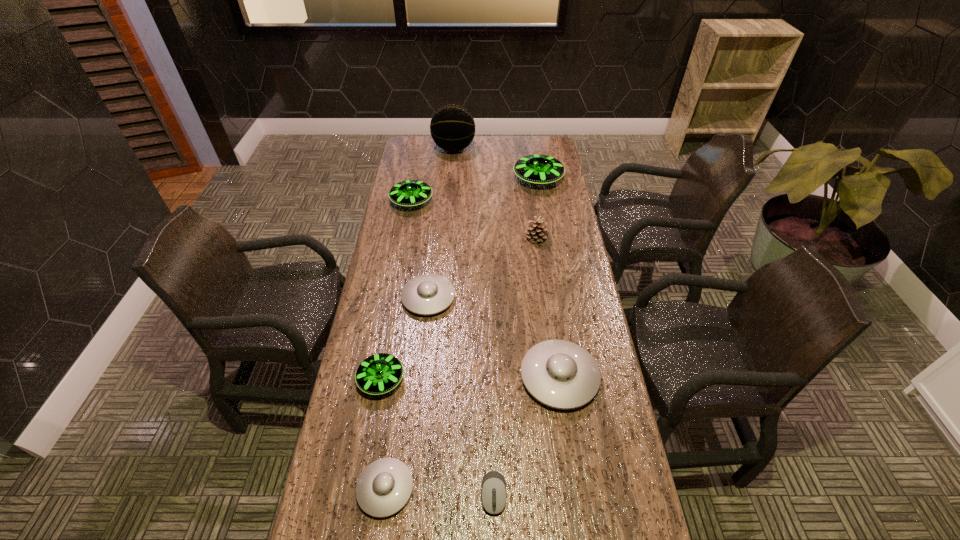
This screenshot has width=960, height=540. What are the coordinates of `basketball` in the screenshot? It's located at (452, 127).

Find the location of `the farthest object`. the farthest object is located at coordinates (452, 127).

The width and height of the screenshot is (960, 540). I want to click on the rightmost green saucer, so click(537, 169).

Locate an element on the screen. The height and width of the screenshot is (540, 960). the biggest green saucer is located at coordinates (537, 169).

Image resolution: width=960 pixels, height=540 pixels. What are the coordinates of `the fourth farthest object` in the screenshot? It's located at (538, 231).

Identify the location of pinecone. (538, 231).

The height and width of the screenshot is (540, 960). Find the location of `the second smallest green saucer`. the second smallest green saucer is located at coordinates (409, 193).

I want to click on the rightmost gray saucer, so coord(560,374).

Locate an element on the screen. the biggest gray saucer is located at coordinates (560, 374).

Locate an element on the screen. The height and width of the screenshot is (540, 960). the nearest green saucer is located at coordinates (380, 373).